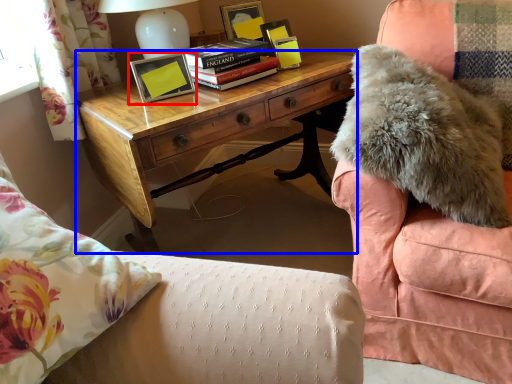
Question: Among these objects, which one is nearest to the camera, picture frame (highlighted by a red box) or desk (highlighted by a blue box)?

Choices:
 (A) picture frame
 (B) desk

Answer: (B)